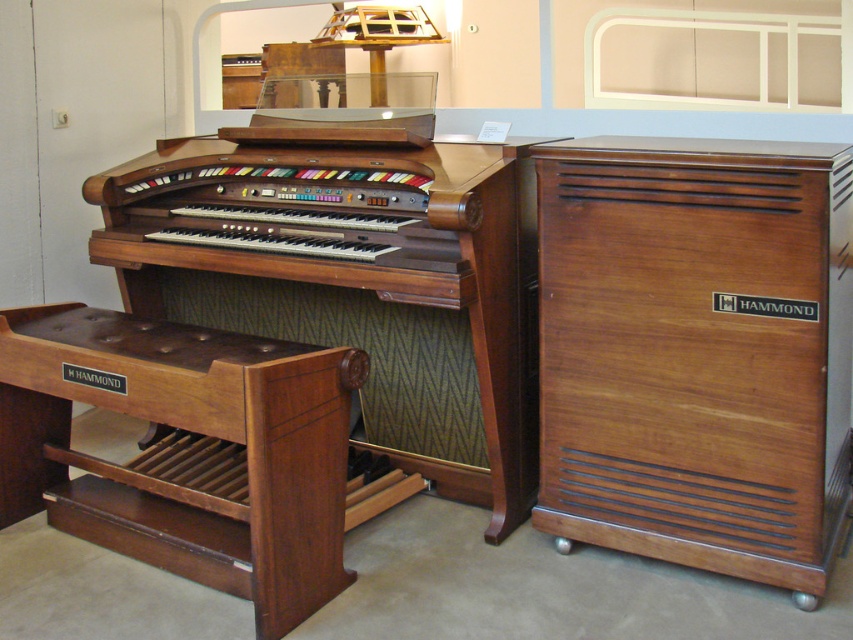
Who is taller, wooden polished organ at center or brown polished wood stool at lower left?

With more height is wooden polished organ at center.

Is point (490, 266) farther from viewer compared to point (271, 515)?

Yes, it is.

You are a GUI agent. You are given a task and a screenshot of the screen. Output one action in this format:
    pyautogui.click(x=<x>, y=<y>)
    Task: Click on the wooden polished organ at center
    
    Given the screenshot: What is the action you would take?
    pyautogui.click(x=364, y=291)